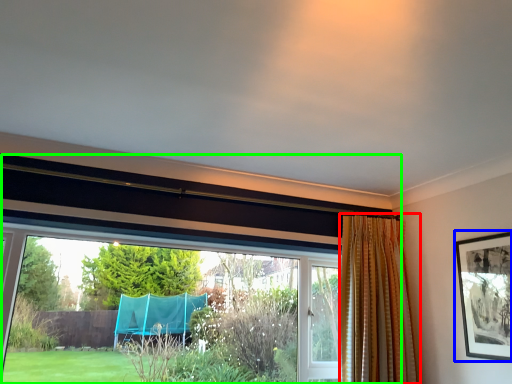
Question: Considering the real-world distances, which object is farthest from curtain (highlighted by a red box)? picture frame (highlighted by a blue box) or window (highlighted by a green box)?

Choices:
 (A) picture frame
 (B) window

Answer: (B)